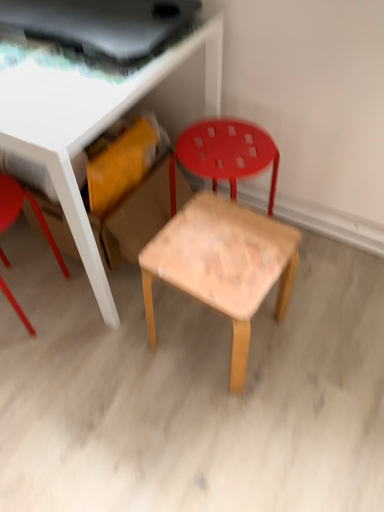
I want to click on vacant space in front of wooden table at center, so click(119, 396).